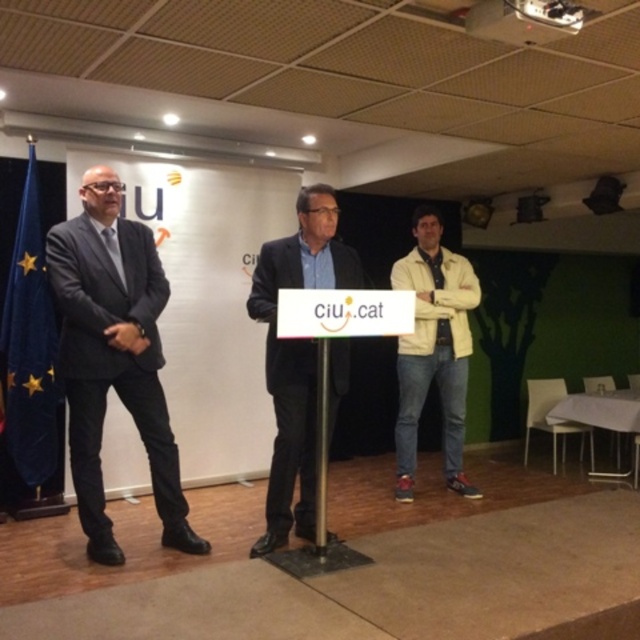
You are standing in the room and want to move from the point at coordinates [108,340] to the point at [410,465]. Is the destination point behind or in front of your starting position?

The destination point at [410,465] is behind the starting point at [108,340] because the description states that point [108,340] is in front of point [410,465].

You are an event organizer who needs to ensure that the dark suit at center and the blue fabric flag at left are visible to the audience. Considering their widths, which object might require more space to be properly displayed?

The dark suit at center requires more space since its width surpasses that of the blue fabric flag at left.

You are standing in the room and want to locate the dark suit at center. What are the coordinates where you can find it?

The dark suit at center can be found at coordinates point (x=296, y=356).